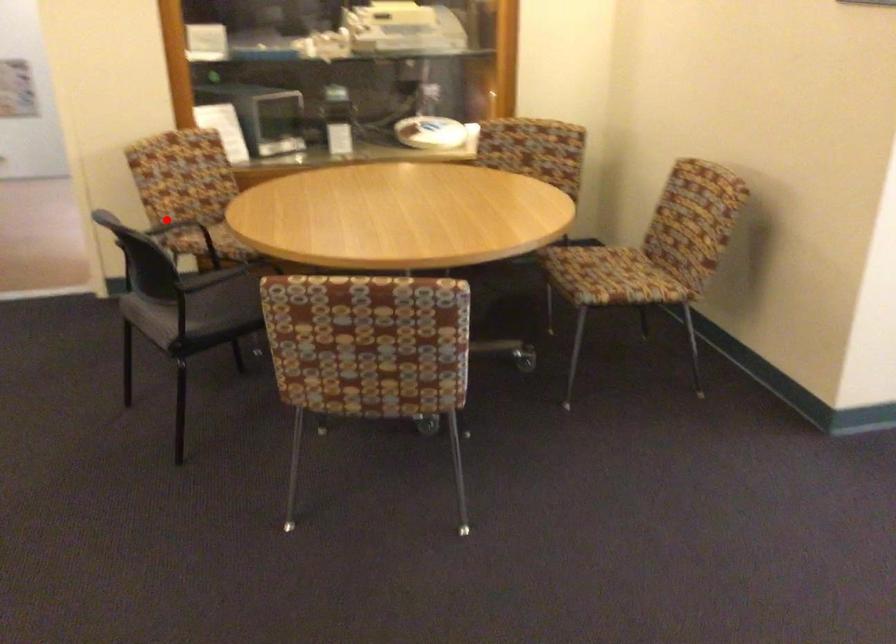
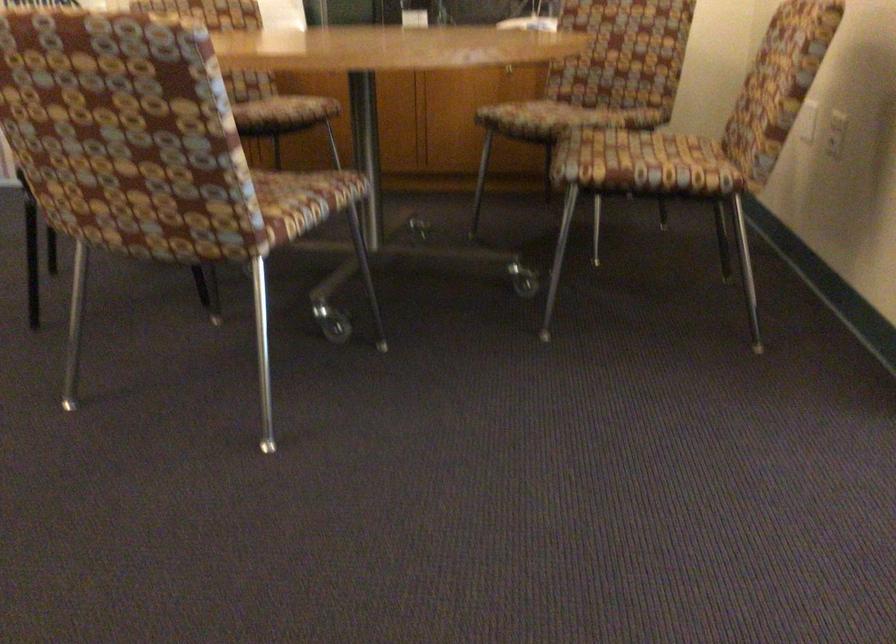
Question: I am providing you with two images of the same scene from different viewpoints. A red point is marked on the first image. Is the red point's position out of view in image 2?

Choices:
 (A) Yes
 (B) No

Answer: (A)